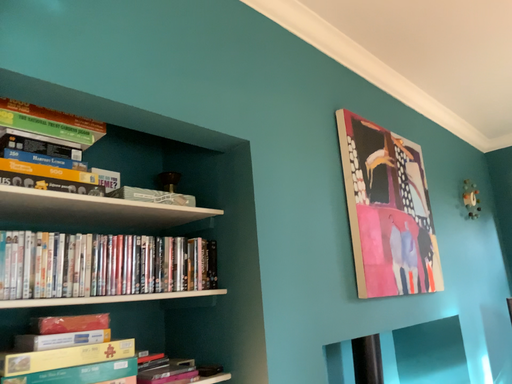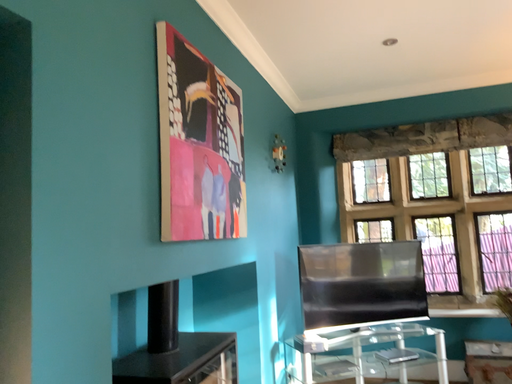
Question: Which way did the camera rotate in the video?

Choices:
 (A) rotated right
 (B) rotated left

Answer: (A)